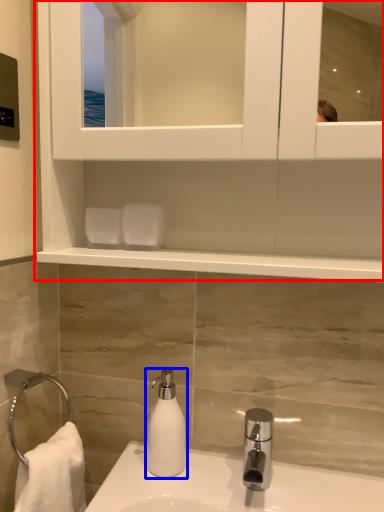
Question: Among these objects, which one is farthest to the camera, cabinet (highlighted by a red box) or soap dispenser (highlighted by a blue box)?

Choices:
 (A) cabinet
 (B) soap dispenser

Answer: (B)